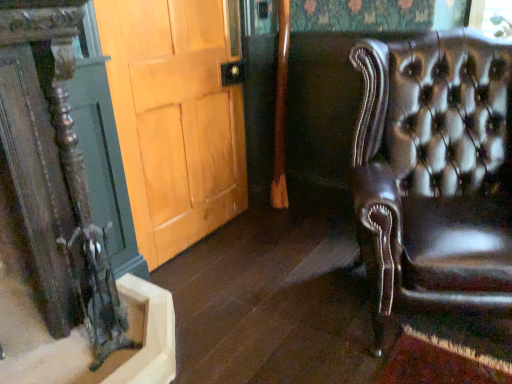
I want to click on free location to the right of light brown wood door at center, so click(x=312, y=249).